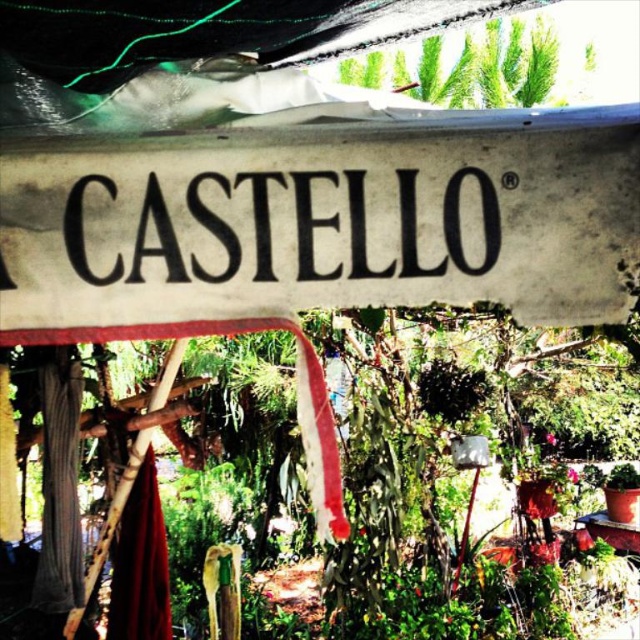
Question: Which point is closer to the camera?

Choices:
 (A) (419, 45)
 (B) (362, 179)

Answer: (B)

Question: Where is white paper sign at center located in relation to black paper sign at center in the image?

Choices:
 (A) above
 (B) below

Answer: (B)

Question: Which point is farther to the camera?

Choices:
 (A) green leafy plant at upper center
 (B) white paper sign at center

Answer: (A)

Question: Is black paper sign at center wider than green leafy plant at upper center?

Choices:
 (A) no
 (B) yes

Answer: (A)

Question: Is white paper sign at center bigger than black paper sign at center?

Choices:
 (A) yes
 (B) no

Answer: (A)

Question: Which object is closer to the camera taking this photo?

Choices:
 (A) white paper sign at center
 (B) green leafy plant at upper center
 (C) black paper sign at center

Answer: (A)